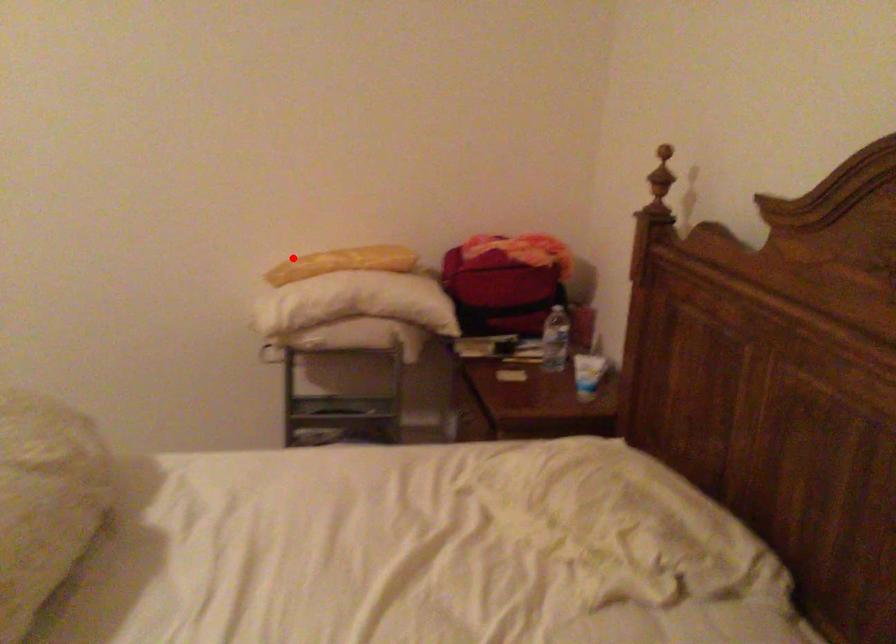
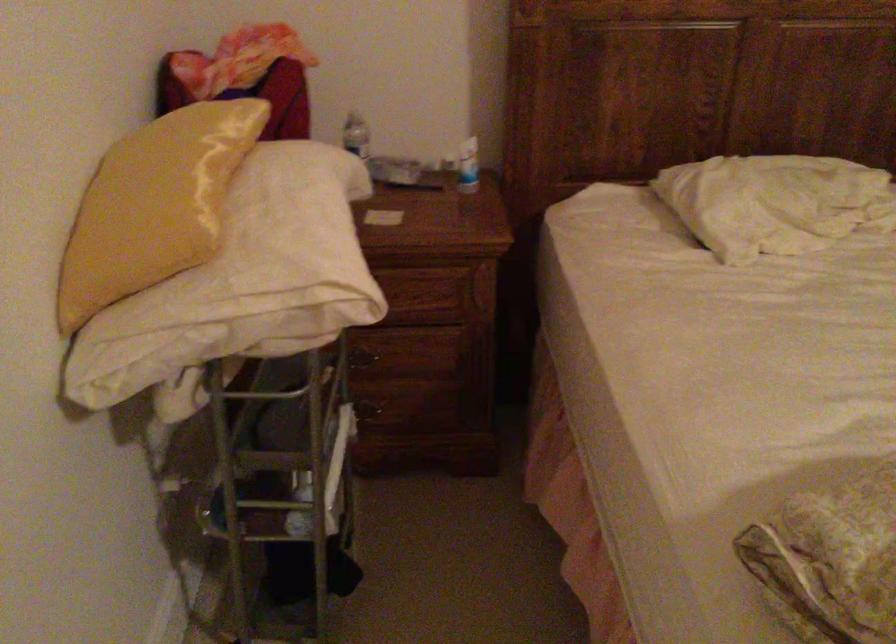
Question: I am providing you with two images of the same scene from different viewpoints. Image1 has a red point marked. In image2, the corresponding 3D location appears at what relative position? Reply with the corresponding letter.

Choices:
 (A) Closer
 (B) Farther

Answer: (A)